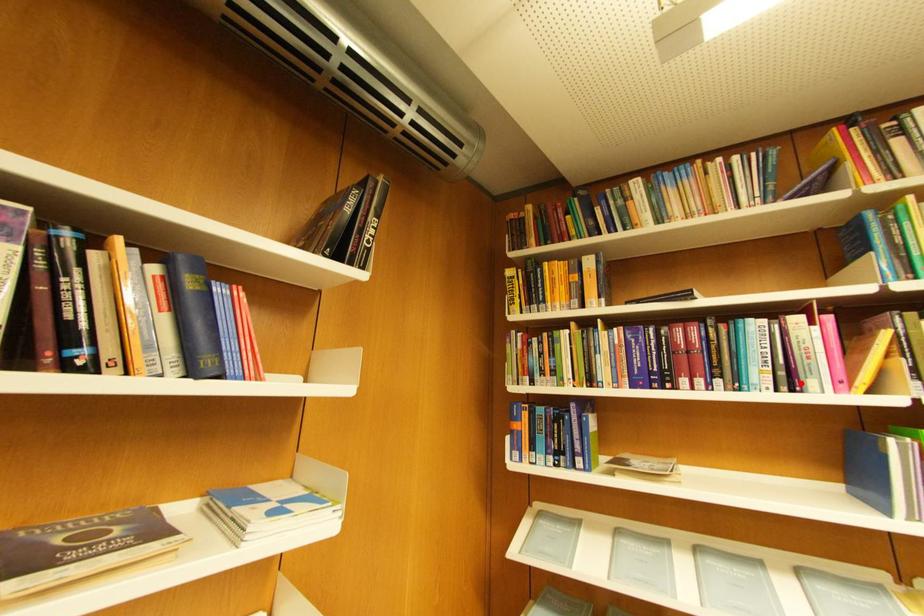
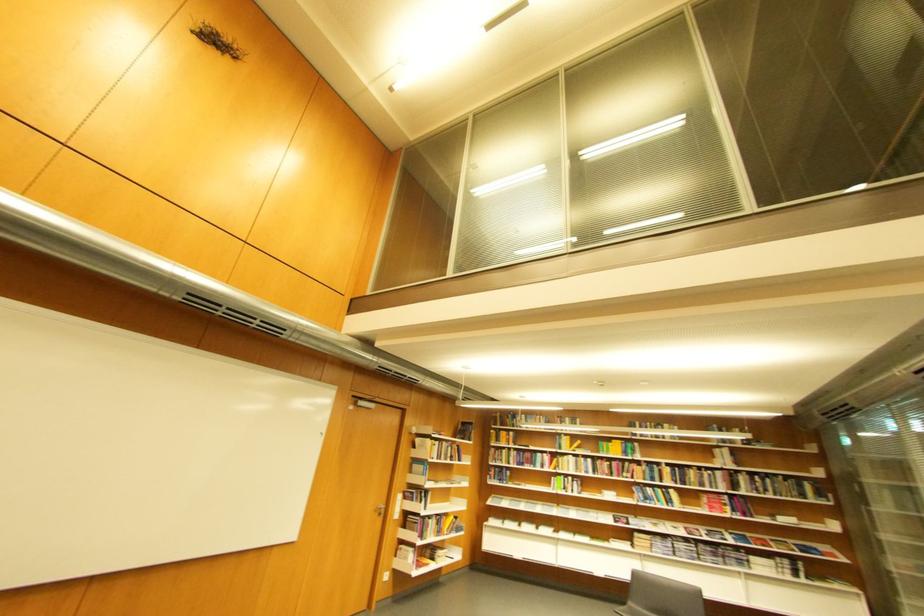
Locate, in the second image, the point that corresponds to the highlighted location in the first image.

(553, 468)